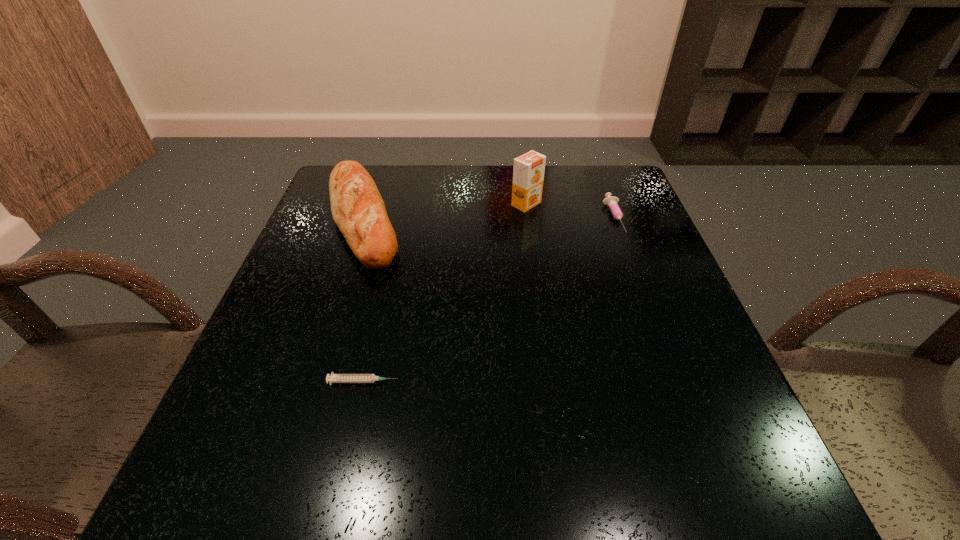
This screenshot has width=960, height=540. In the image, there is a desktop. Find the location of `free region at the left edge`. free region at the left edge is located at coordinates (297, 253).

In the image, there is a desktop. Find the location of `vacant space at the right edge`. vacant space at the right edge is located at coordinates (621, 242).

At what (x,y) coordinates should I click in order to perform the action: click on blank area at the far right corner. Please return your answer as a coordinate pair (x, y). This screenshot has width=960, height=540. Looking at the image, I should click on (579, 191).

This screenshot has width=960, height=540. In order to click on vacant space at the near right corner of the desktop in this screenshot , I will do `click(732, 464)`.

Where is `unoccupied area between the orange juice and the right syringe`? Image resolution: width=960 pixels, height=540 pixels. unoccupied area between the orange juice and the right syringe is located at coordinates (570, 211).

The height and width of the screenshot is (540, 960). In order to click on free space that is in between the tallest object and the second shortest object in this screenshot , I will do `click(570, 211)`.

In order to click on empty location between the baguet and the second shortest object in this screenshot , I will do `click(489, 218)`.

Where is `empty location between the left syringe and the baguet`? empty location between the left syringe and the baguet is located at coordinates (363, 300).

This screenshot has height=540, width=960. In order to click on empty space between the third shortest object and the nearer syringe in this screenshot , I will do `click(363, 300)`.

Identify the location of vacant space in between the baguet and the second object from right to left. (444, 211).